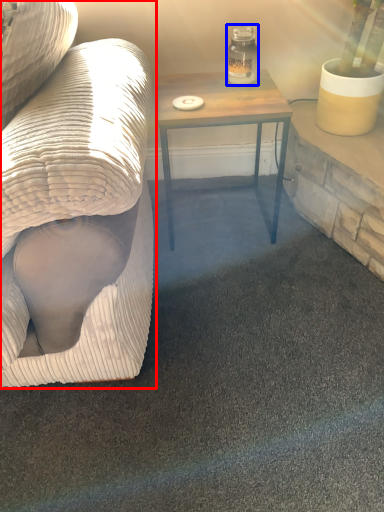
Question: Among these objects, which one is farthest to the camera, studio couch (highlighted by a red box) or glass jar (highlighted by a blue box)?

Choices:
 (A) studio couch
 (B) glass jar

Answer: (B)